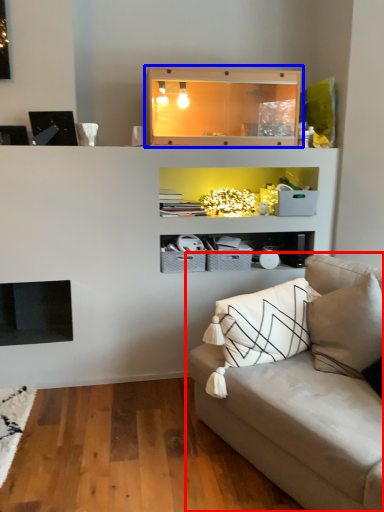
Question: Which of the following is the farthest to the observer, studio couch (highlighted by a red box) or shelf (highlighted by a blue box)?

Choices:
 (A) studio couch
 (B) shelf

Answer: (B)